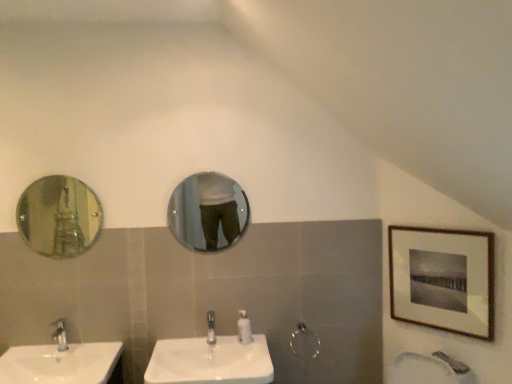
Question: Which direction should I rotate to look at matte glass mirror at center, the second mirror when ordered from front to back?

Choices:
 (A) left
 (B) right

Answer: (A)

Question: Is white glossy soap dispenser at center closer to the viewer compared to shiny silver mirror at left, the 1th mirror viewed from the front?

Choices:
 (A) no
 (B) yes

Answer: (A)

Question: Is white glossy soap dispenser at center beside shiny silver mirror at left, the 2th mirror viewed from the right?

Choices:
 (A) no
 (B) yes

Answer: (A)

Question: Is white glossy soap dispenser at center behind shiny silver mirror at left, the 1th mirror viewed from the front?

Choices:
 (A) yes
 (B) no

Answer: (A)

Question: Is white glossy soap dispenser at center turned away from shiny silver mirror at left, placed as the second mirror when sorted from back to front?

Choices:
 (A) yes
 (B) no

Answer: (B)

Question: Is white glossy soap dispenser at center wider than shiny silver mirror at left, arranged as the first mirror when viewed from the left?

Choices:
 (A) no
 (B) yes

Answer: (B)

Question: Would you say shiny silver mirror at left, arranged as the first mirror when viewed from the left, is part of white glossy soap dispenser at center's contents?

Choices:
 (A) yes
 (B) no

Answer: (B)

Question: Can you confirm if white glossy sink at lower left, acting as the second sink starting from the right, is taller than silver metallic faucet at lower left, the first tap viewed from the left?

Choices:
 (A) no
 (B) yes

Answer: (A)

Question: Does white glossy sink at lower left, acting as the second sink starting from the right, have a lesser width compared to silver metallic faucet at lower left, the first tap viewed from the left?

Choices:
 (A) no
 (B) yes

Answer: (A)

Question: Is white glossy sink at lower left, which ranks as the first sink in left-to-right order, to the left of silver metallic faucet at lower left, the first tap viewed from the left, from the viewer's perspective?

Choices:
 (A) no
 (B) yes

Answer: (A)

Question: Would you say white glossy sink at lower left, acting as the second sink starting from the right, contains silver metallic faucet at lower left, the first tap viewed from the left?

Choices:
 (A) no
 (B) yes

Answer: (A)

Question: Is white glossy sink at lower left, which ranks as the first sink in left-to-right order, oriented away from silver metallic faucet at lower left, the first tap viewed from the left?

Choices:
 (A) no
 (B) yes

Answer: (A)

Question: From the image's perspective, would you say white glossy sink at lower left, which ranks as the first sink in left-to-right order, is shown under silver metallic faucet at lower left, the 2th tap when ordered from right to left?

Choices:
 (A) yes
 (B) no

Answer: (A)

Question: Does wooden-framed print at upper right have a smaller size compared to white glossy sink at center, the second sink positioned from the left?

Choices:
 (A) no
 (B) yes

Answer: (B)